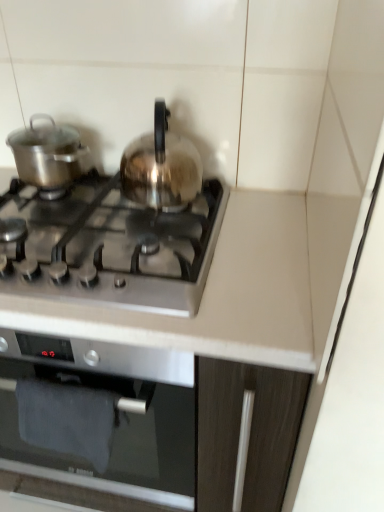
Question: From a real-world perspective, is satin silver kettle at center, the second kitchen appliance when ordered from left to right, positioned above or below satin silver gas stove at center?

Choices:
 (A) above
 (B) below

Answer: (A)

Question: Is satin silver kettle at center, the second kitchen appliance when ordered from left to right, in front of or behind satin silver gas stove at center in the image?

Choices:
 (A) behind
 (B) front

Answer: (A)

Question: Which is farther from the satin silver gas stove at center?

Choices:
 (A) satin silver kettle at center, marked as the first kitchen appliance in a right-to-left arrangement
 (B) shiny silver pot at left, acting as the second kitchen appliance starting from the right

Answer: (B)

Question: Estimate the real-world distances between objects in this image. Which object is farther from the satin silver gas stove at center?

Choices:
 (A) satin silver kettle at center, marked as the first kitchen appliance in a right-to-left arrangement
 (B) shiny silver pot at left, acting as the second kitchen appliance starting from the right

Answer: (B)